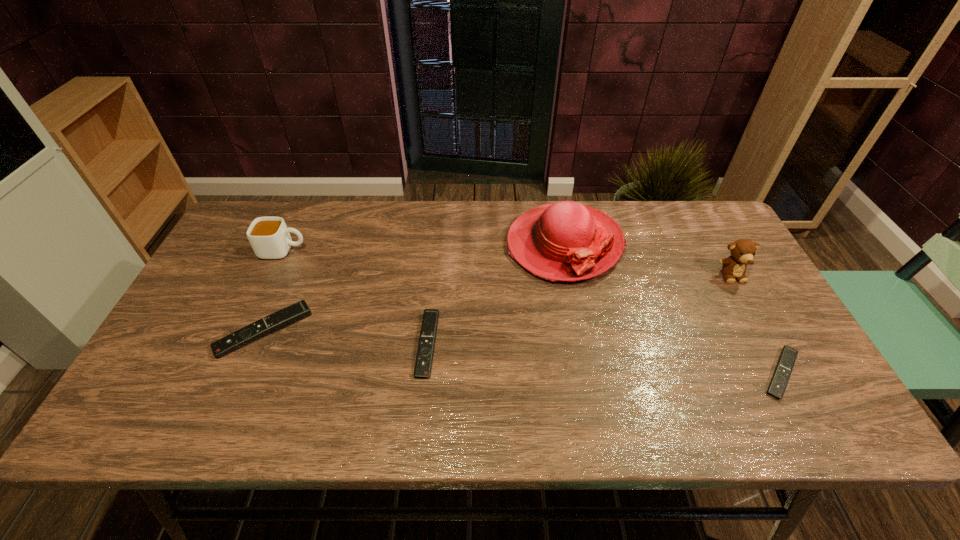
Locate an element on the screen. free space located 0.110m on the back of the leftmost remote control is located at coordinates (287, 275).

This screenshot has width=960, height=540. Find the location of `vacant space located on the right of the second tallest remote control`. vacant space located on the right of the second tallest remote control is located at coordinates (598, 344).

Identify the location of free location located 0.190m on the left of the rightmost remote control. (675, 374).

Find the location of a particular element. Image resolution: width=960 pixels, height=540 pixels. vacant space located at the front of the fourth object from left to right with a bow is located at coordinates (588, 370).

This screenshot has height=540, width=960. In order to click on free region located 0.230m on the side with the handle of the cup in this screenshot , I will do pos(383,251).

You are a GUI agent. You are given a task and a screenshot of the screen. Output one action in this format:
    pyautogui.click(x=<x>, y=<y>)
    Task: Click on the vacant space located on the face of the teddy bear
    
    Given the screenshot: What is the action you would take?
    pyautogui.click(x=764, y=333)

Where is `hat located in the far edge section of the desktop`? The image size is (960, 540). hat located in the far edge section of the desktop is located at coordinates (565, 241).

This screenshot has height=540, width=960. I want to click on cup that is at the far edge, so click(x=269, y=237).

Locate an element on the screen. This screenshot has width=960, height=540. remote control that is at the left edge is located at coordinates (300, 310).

Find the location of a particular element. cup situated at the left edge is located at coordinates (269, 237).